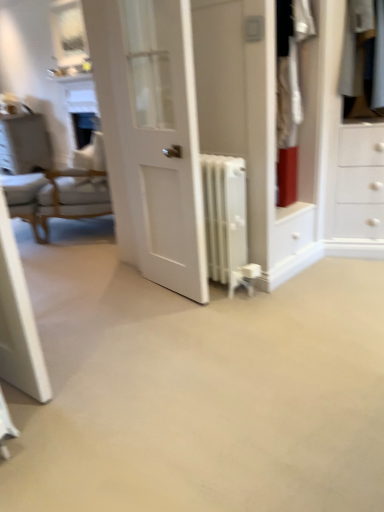
This screenshot has height=512, width=384. Describe the element at coordinates (363, 60) in the screenshot. I see `white cotton shirt at upper right` at that location.

The width and height of the screenshot is (384, 512). What are the coordinates of `light brown wooden armchair at left` in the screenshot? It's located at (23, 196).

This screenshot has width=384, height=512. What are the coordinates of `white cotton shirt at upper right` in the screenshot? It's located at (363, 60).

In the scene shown: In the image, is white glossy vanity at upper left on the left side or the right side of white metallic radiator at center?

Based on their positions, white glossy vanity at upper left is located to the left of white metallic radiator at center.

Between white glossy vanity at upper left and white metallic radiator at center, which one has less height?

Standing shorter between the two is white metallic radiator at center.

From a real-world perspective, who is located higher, white glossy vanity at upper left or white metallic radiator at center?

In real-world perspective, white metallic radiator at center is above.

From the image's perspective, which object appears higher, white glossy vanity at upper left or white metallic radiator at center?

white glossy vanity at upper left appears higher in the image.

Is white cotton shirt at upper right positioned with its back to white glossy vanity at upper left?

white cotton shirt at upper right is not turned away from white glossy vanity at upper left.

From the image's perspective, is white cotton shirt at upper right beneath white glossy vanity at upper left?

Yes, from the image's perspective, white cotton shirt at upper right is below white glossy vanity at upper left.

From the picture: Is white cotton shirt at upper right with white glossy vanity at upper left?

No, white cotton shirt at upper right is not beside white glossy vanity at upper left.

How many degrees apart are the facing directions of white cotton shirt at upper right and white glossy vanity at upper left?

They differ by 28 degrees in their facing directions.

Does white fabric chair at left have a greater height compared to white glossy door at center?

No.

Can you confirm if white fabric chair at left is wider than white glossy door at center?

Indeed, white fabric chair at left has a greater width compared to white glossy door at center.

Which of these two, white fabric chair at left or white glossy door at center, is bigger?

white fabric chair at left is bigger.

From the picture: Is white cotton shirt at upper right at the back of white fabric chair at left?

Yes.

Looking at this image, relative to white cotton shirt at upper right, is white fabric chair at left in front or behind?

white fabric chair at left is positioned farther from the viewer than white cotton shirt at upper right.

Are white fabric chair at left and white cotton shirt at upper right beside each other?

They are not placed beside each other.

Is white fabric chair at left shorter than white cotton shirt at upper right?

Incorrect, the height of white fabric chair at left does not fall short of that of white cotton shirt at upper right.

The height and width of the screenshot is (512, 384). In order to click on door that appears on the left of white cotton shirt at upper right in this screenshot , I will do `click(151, 137)`.

From a real-world perspective, between white cotton shirt at upper right and white glossy door at center, who is vertically higher?

white cotton shirt at upper right.

From the image's perspective, which is above, white cotton shirt at upper right or white glossy door at center?

white cotton shirt at upper right is shown above in the image.

Can you see white glossy door at center touching white metallic radiator at center?

white glossy door at center and white metallic radiator at center are not in contact.

Between point (136, 205) and point (230, 179), which one is positioned behind?

The point (136, 205) is farther.

Considering the relative sizes of white glossy door at center and white metallic radiator at center in the image provided, is white glossy door at center smaller than white metallic radiator at center?

Actually, white glossy door at center might be larger than white metallic radiator at center.

From a real-world perspective, between white glossy door at center and white metallic radiator at center, who is vertically lower?

white metallic radiator at center is physically lower.

Does white glossy vanity at upper left appear on the left side of white glossy door at center?

Indeed, white glossy vanity at upper left is positioned on the left side of white glossy door at center.

How many degrees apart are the facing directions of white glossy vanity at upper left and white glossy door at center?

The facing directions of white glossy vanity at upper left and white glossy door at center are 2.76 degrees apart.

In terms of height, does white glossy vanity at upper left look taller or shorter compared to white glossy door at center?

In the image, white glossy vanity at upper left appears to be shorter than white glossy door at center.

Who is more distant, white glossy vanity at upper left or white glossy door at center?

white glossy vanity at upper left.

You are a GUI agent. You are given a task and a screenshot of the screen. Output one action in this format:
    pyautogui.click(x=<x>, y=<y>)
    Task: Click on the radiator that is on the right side of white glossy vanity at upper left
    The height and width of the screenshot is (512, 384).
    Given the screenshot: What is the action you would take?
    pyautogui.click(x=224, y=214)

Locate an element on the screen. The height and width of the screenshot is (512, 384). clothing above the white glossy vanity at upper left (from a real-world perspective) is located at coordinates pyautogui.click(x=363, y=60).

When comparing their distances from white metallic radiator at center, does white glossy vanity at upper left or white glossy door at center seem closer?

The object closer to white metallic radiator at center is white glossy door at center.

Considering their positions, is white fabric chair at left positioned further to light brown wooden armchair at left than white glossy vanity at upper left?

white glossy vanity at upper left is positioned further to the anchor light brown wooden armchair at left.

Which object lies nearer to the anchor point white glossy door at center, white cotton shirt at upper right or white fabric chair at left?

white fabric chair at left.

In the scene shown: Looking at the image, which one is located further to white glossy vanity at upper left, white cotton shirt at upper right or white metallic radiator at center?

white cotton shirt at upper right.

Based on their spatial positions, is light brown wooden armchair at left or white cotton shirt at upper right further from white metallic radiator at center?

light brown wooden armchair at left.

Looking at the image, which one is located further to white metallic radiator at center, white glossy vanity at upper left or white cotton shirt at upper right?

white glossy vanity at upper left is further to white metallic radiator at center.

Looking at the image, which one is located closer to white cotton shirt at upper right, white metallic radiator at center or white glossy vanity at upper left?

The object closer to white cotton shirt at upper right is white metallic radiator at center.

Which object lies further to the anchor point white fabric chair at left, light brown wooden armchair at left or white glossy vanity at upper left?

white glossy vanity at upper left.

Locate an element on the screen. This screenshot has width=384, height=512. chair located between white cotton shirt at upper right and white glossy vanity at upper left in the depth direction is located at coordinates (45, 178).

I want to click on armchair between white metallic radiator at center and white glossy vanity at upper left along the z-axis, so click(x=23, y=196).

Locate an element on the screen. The image size is (384, 512). clothing positioned between white glossy door at center and white glossy vanity at upper left from near to far is located at coordinates (363, 60).

The image size is (384, 512). Find the location of `radiator situated between white fabric chair at left and white cotton shirt at upper right from left to right`. radiator situated between white fabric chair at left and white cotton shirt at upper right from left to right is located at coordinates (224, 214).